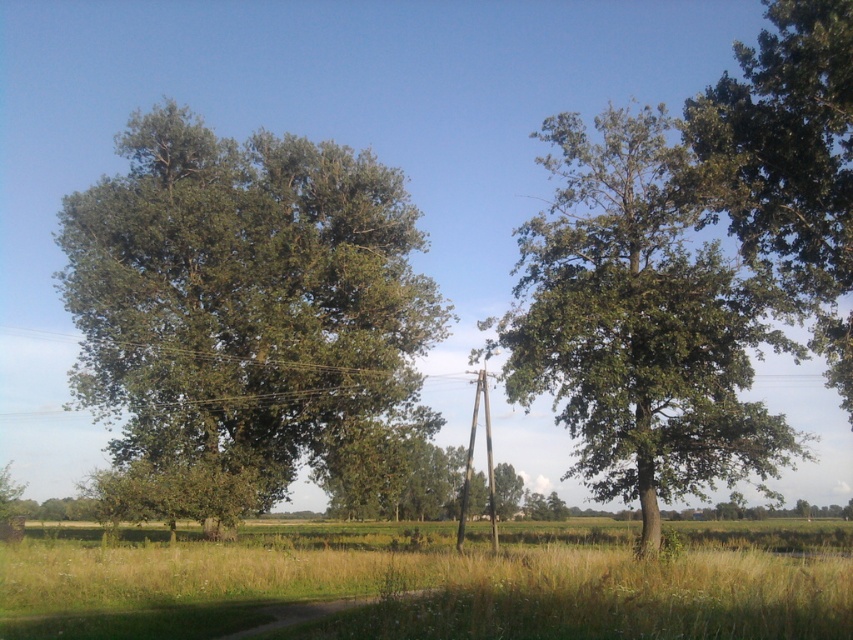
Question: Where is green leafy tree at left located in relation to green leafy tree at right in the image?

Choices:
 (A) right
 (B) left

Answer: (B)

Question: Which object is closer to the camera taking this photo?

Choices:
 (A) green grass at lower center
 (B) green leafy tree at right
 (C) brown wooden telegraph pole at center
 (D) green leafy tree at upper right

Answer: (A)

Question: Is green grass at lower center smaller than brown wooden telegraph pole at center?

Choices:
 (A) no
 (B) yes

Answer: (A)

Question: Considering the real-world distances, which object is farthest from the green leafy tree at right?

Choices:
 (A) green leafy tree at upper right
 (B) green leafy tree at left

Answer: (B)

Question: Is the position of green leafy tree at right less distant than that of green leafy tree at upper right?

Choices:
 (A) yes
 (B) no

Answer: (A)

Question: Which point is farther from the camera taking this photo?

Choices:
 (A) (467, 492)
 (B) (734, 100)
 (C) (189, 582)
 (D) (119, 474)

Answer: (D)